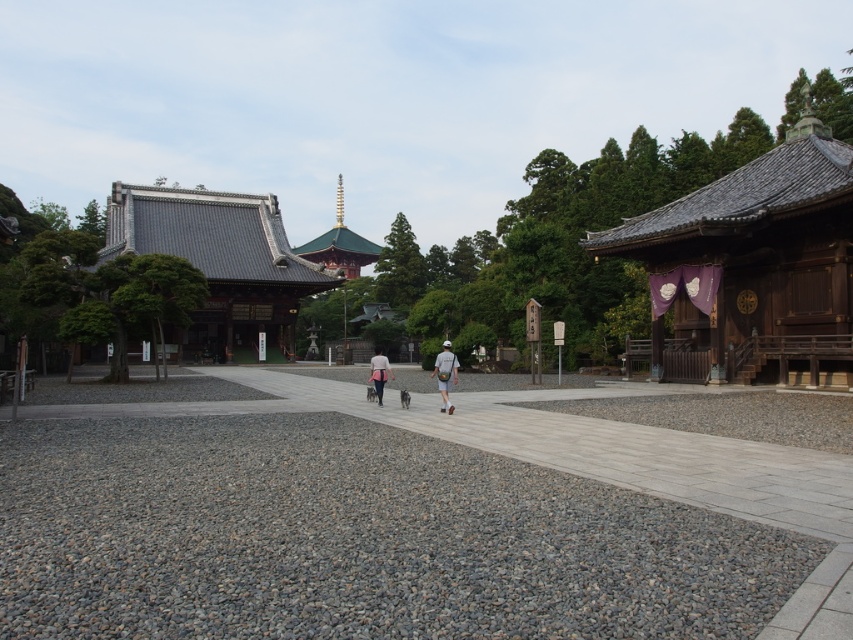
You are a visitor at the temple complex and want to place your light gray fabric backpack at center on the gray gravel path at center. Is the backpack on the path already or do you need to move it?

The gray gravel path at center is closer to the viewer than the light gray fabric backpack at center, meaning the backpack is placed behind the path. Therefore, you need to move it onto the path.

From the picture: You are planning to place a small decorative rock on the gray gravel path at center. However, you also have a light gray fabric bag at center that you want to keep visible. Which object should you place the rock on to ensure the bag remains visible?

The gray gravel path at center has a smaller size compared to the light gray fabric bag at center. To ensure the light gray fabric bag at center remains visible, you should place the decorative rock on the gray gravel path at center since it is smaller and less likely to obstruct the view of the larger bag.

You are standing at the entrance of the temple complex and want to reach the main building. The gray gravel at lower left and the gray gravel path at center are both in your path. Which path should you take to reach the main building?

The gray gravel path at center is the correct path to reach the main building because it is behind the gray gravel at lower left, indicating it leads further towards the temple complex.